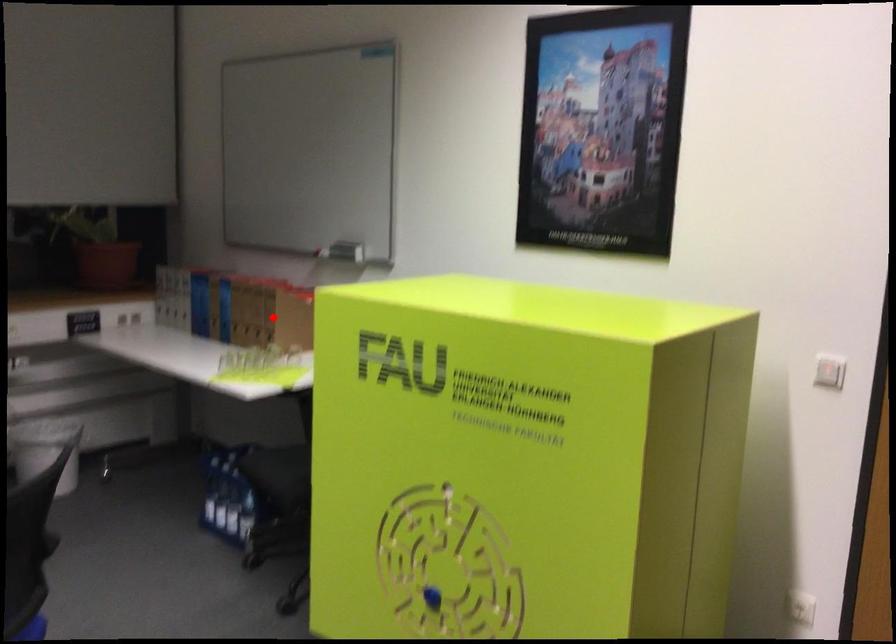
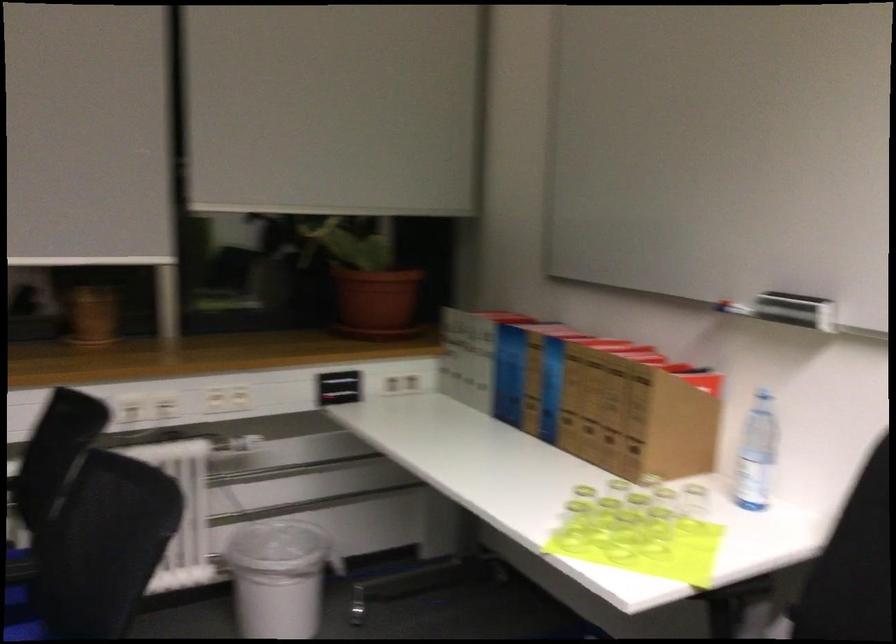
Where in the second image is the point corresponding to the highlighted location from the first image?

(634, 417)